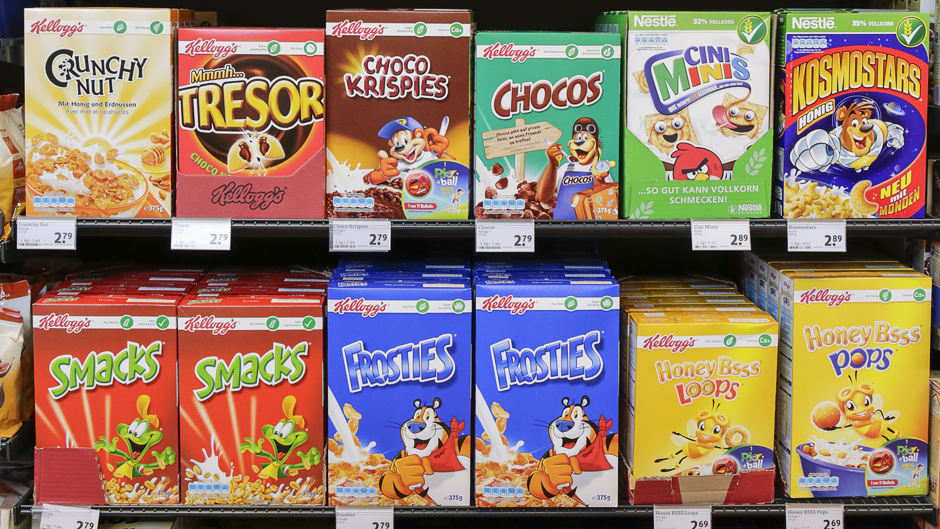
Locate an element on the screen. Image resolution: width=940 pixels, height=529 pixels. cereal on top shelf is located at coordinates (70, 58), (263, 102), (404, 107), (542, 116), (797, 123), (719, 117).